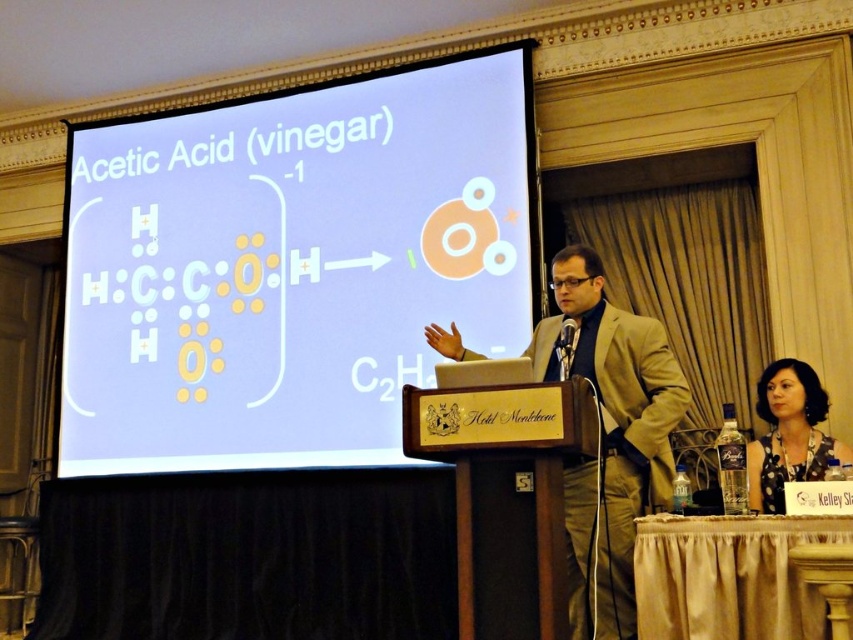
You are standing in the conference room and want to place a small decoration exactly at point [397,384]. If your current position is 3 meters away from the camera, will you need to move forward or backward to reach that point?

The point [397,384] is 4.98 meters from the camera. Since you are currently 3 meters away, you need to move forward 1.98 meters to reach it.

You are an event planner setting up a presentation. You have two items to place on the stage. The white glossy projection screen at center and the dark gray fabric at lower right. Which item should you place first if you want to ensure the larger object is positioned centrally?

The white glossy projection screen at center should be placed first because it is larger than the dark gray fabric at lower right, ensuring it is centered properly before arranging the smaller item.

You are attending a chemistry lecture and notice the white glossy projection screen at center and the beige suit at center. Which object is taller?

The white glossy projection screen at center is much taller than the beige suit at center.